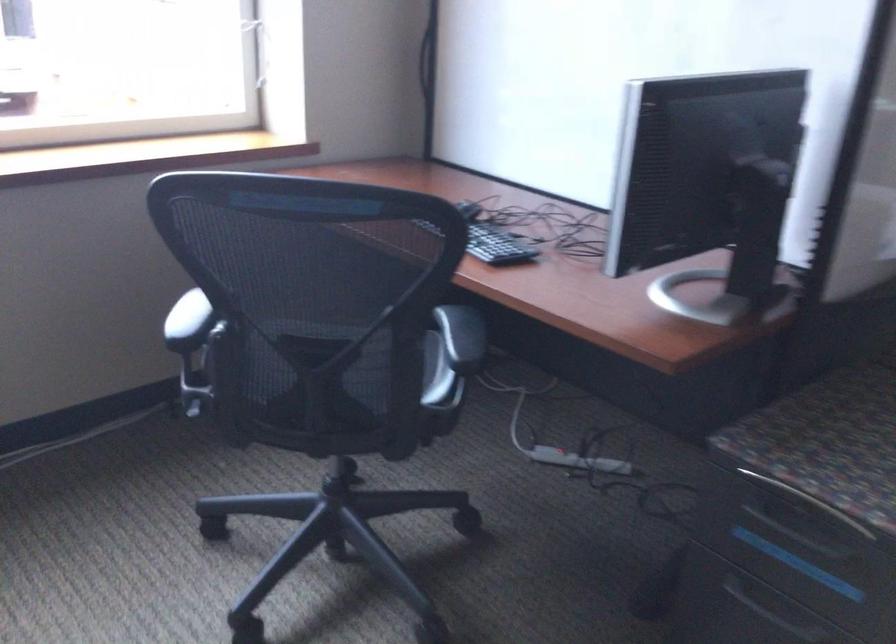
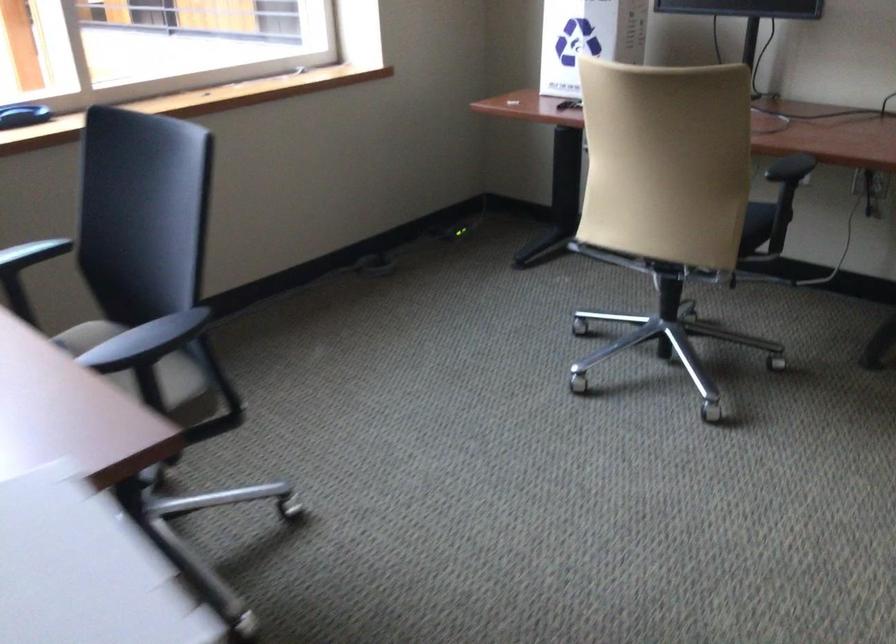
The images are taken continuously from a first-person perspective. In which direction are you moving?

The cameraman walked toward right, forward.